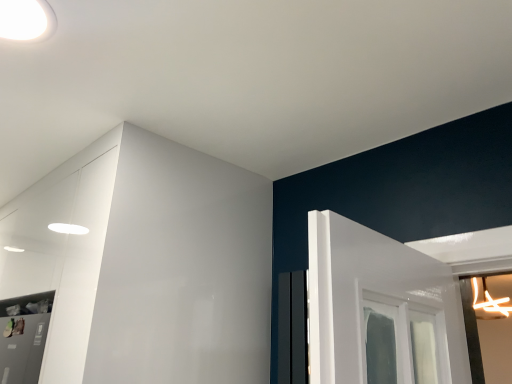
Question: Is white glossy dresser at upper left shorter than white glossy light fixture at upper left?

Choices:
 (A) no
 (B) yes

Answer: (A)

Question: Does white glossy dresser at upper left have a larger size compared to white glossy light fixture at upper left?

Choices:
 (A) yes
 (B) no

Answer: (A)

Question: Are white glossy dresser at upper left and white glossy light fixture at upper left beside each other?

Choices:
 (A) no
 (B) yes

Answer: (A)

Question: Is the position of white glossy dresser at upper left more distant than that of white glossy light fixture at upper left?

Choices:
 (A) no
 (B) yes

Answer: (B)

Question: Are white glossy dresser at upper left and white glossy light fixture at upper left far apart?

Choices:
 (A) yes
 (B) no

Answer: (B)

Question: Is the position of white glossy dresser at upper left less distant than that of white glossy light fixture at upper left?

Choices:
 (A) yes
 (B) no

Answer: (B)

Question: From a real-world perspective, is white glossy light fixture at upper left located beneath white glossy dresser at upper left?

Choices:
 (A) no
 (B) yes

Answer: (A)

Question: Is white glossy light fixture at upper left thinner than white glossy dresser at upper left?

Choices:
 (A) no
 (B) yes

Answer: (B)

Question: Is white glossy light fixture at upper left aimed at white glossy dresser at upper left?

Choices:
 (A) no
 (B) yes

Answer: (A)

Question: Is white glossy light fixture at upper left wider than white glossy dresser at upper left?

Choices:
 (A) no
 (B) yes

Answer: (A)

Question: Could white glossy dresser at upper left be considered to be inside white glossy light fixture at upper left?

Choices:
 (A) no
 (B) yes

Answer: (A)

Question: Are white glossy light fixture at upper left and white glossy dresser at upper left located far from each other?

Choices:
 (A) no
 (B) yes

Answer: (A)

Question: In terms of width, does white glossy light fixture at upper left look wider or thinner when compared to white glossy dresser at upper left?

Choices:
 (A) wide
 (B) thin

Answer: (B)